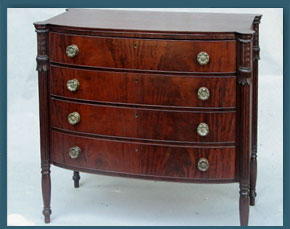
This screenshot has width=290, height=229. I want to click on third drawer, so click(x=146, y=123).